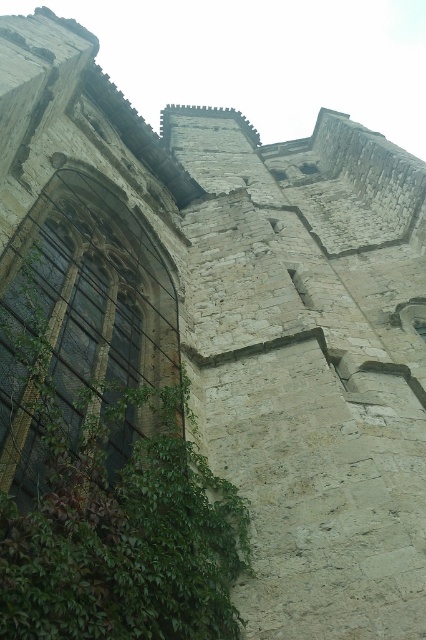
You are standing in front of the old stone building and notice a green leafy plant at lower left and a dark glass window at left. Which object is positioned more to the right side?

The green leafy plant at lower left is positioned more to the right side than the dark glass window at left.

You are a window cleaner who needs to clean the dark glass window at left and the green leafy plant at lower left. Which object requires a smaller cleaning tool?

The green leafy plant at lower left requires a smaller cleaning tool because it is smaller than the dark glass window at left.

You are a maintenance worker inspecting the old stone building. You notice the green leafy plant at lower left and the dark glass window at left. Which object is located below the other?

The green leafy plant at lower left is positioned under the dark glass window at left, so the plant is below the window.